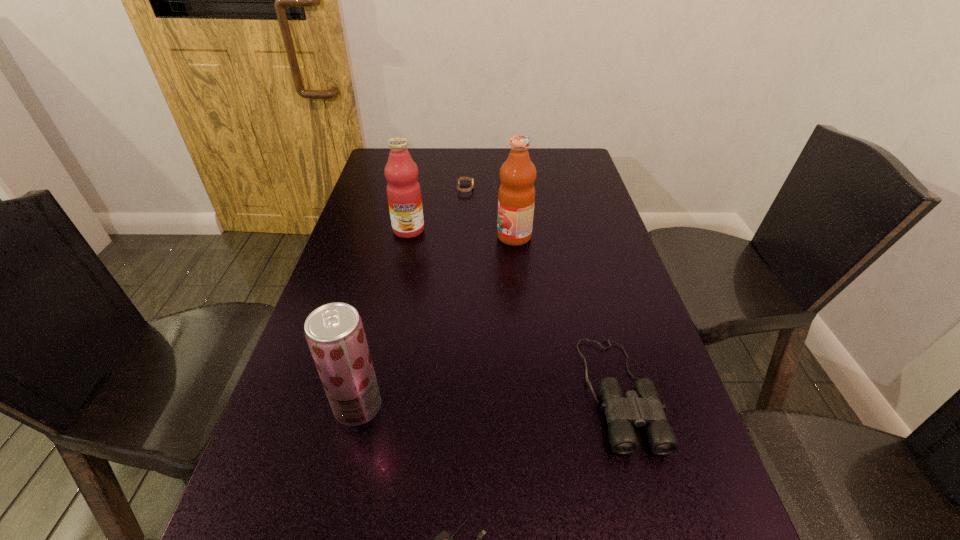
Identify the location of vacant point located 0.140m on the right of the shortest fruit juice. The height and width of the screenshot is (540, 960). (454, 407).

Where is `vacant space located 0.130m at the eyepiece of the binoculars`? vacant space located 0.130m at the eyepiece of the binoculars is located at coordinates (660, 537).

At what (x,y) coordinates should I click in order to perform the action: click on vacant space situated on the face of the farthest object. Please return your answer as a coordinate pair (x, y). Looking at the image, I should click on (565, 188).

This screenshot has width=960, height=540. In order to click on object situated at the right edge in this screenshot , I will do `click(642, 407)`.

Locate an element on the screen. The height and width of the screenshot is (540, 960). free space at the far edge of the desktop is located at coordinates (438, 162).

In the image, there is a desktop. Identify the location of vacant space at the left edge. The height and width of the screenshot is (540, 960). (254, 467).

This screenshot has width=960, height=540. In the image, there is a desktop. Identify the location of vacant space at the right edge. (585, 310).

Identify the location of free space between the rightmost fruit juice and the second shortest object. The image size is (960, 540). (490, 213).

Image resolution: width=960 pixels, height=540 pixels. Find the location of `vacant space that's between the fifth tallest object and the binoculars`. vacant space that's between the fifth tallest object and the binoculars is located at coordinates (542, 290).

Point out which object is positioned as the fifth nearest to the nearest fruit juice. Please provide its 2D coordinates. Your answer should be formatted as a tuple, i.e. [(x, y)], where the tuple contains the x and y coordinates of a point satisfying the conditions above.

[(461, 178)]